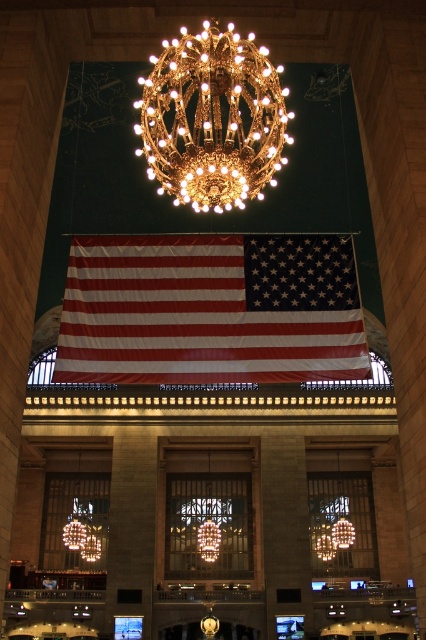
Is point (322, 365) more distant than point (218, 97)?

Yes, it is.

What do you see at coordinates (210, 308) in the screenshot? I see `matte fabric flag at center` at bounding box center [210, 308].

Is point (103, 369) closer to viewer compared to point (265, 76)?

No, it is not.

I want to click on matte fabric flag at center, so click(x=210, y=308).